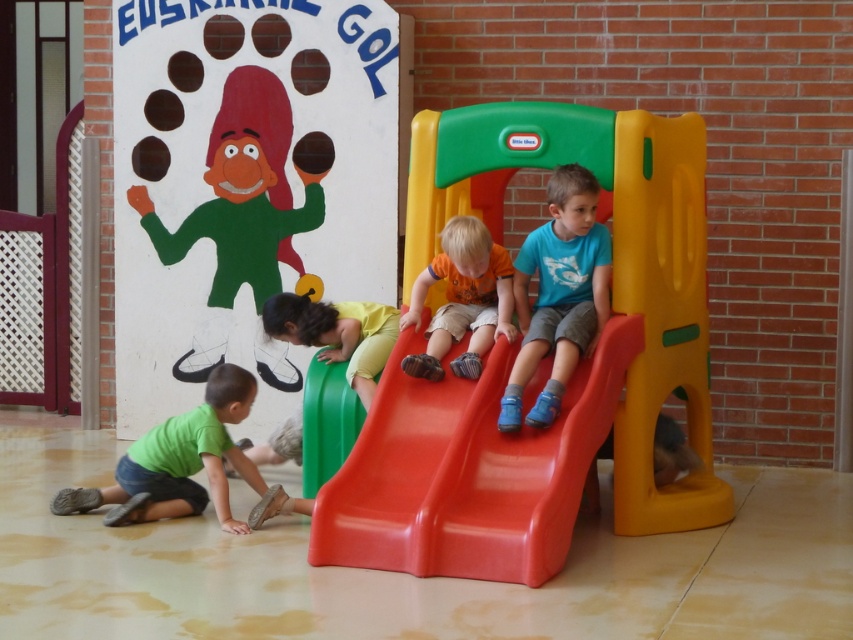
Question: Which point is farther from the camera taking this photo?

Choices:
 (A) (563, 209)
 (B) (227, 252)
 (C) (503, 332)

Answer: (B)

Question: Where is green matte shirt at lower left located in relation to yellow matte slide at lower center in the image?

Choices:
 (A) below
 (B) above

Answer: (A)

Question: Does red plastic slide at center appear over yellow matte slide at lower center?

Choices:
 (A) yes
 (B) no

Answer: (B)

Question: Is green matte figure at upper left smaller than orange matte shirt at center?

Choices:
 (A) no
 (B) yes

Answer: (A)

Question: Which object is farther from the camera taking this photo?

Choices:
 (A) matte plastic slide at center
 (B) green matte shirt at lower left

Answer: (B)

Question: Which of the following is the closest to the observer?

Choices:
 (A) (247, 81)
 (B) (268, 300)
 (C) (225, 493)
 (D) (543, 465)

Answer: (D)